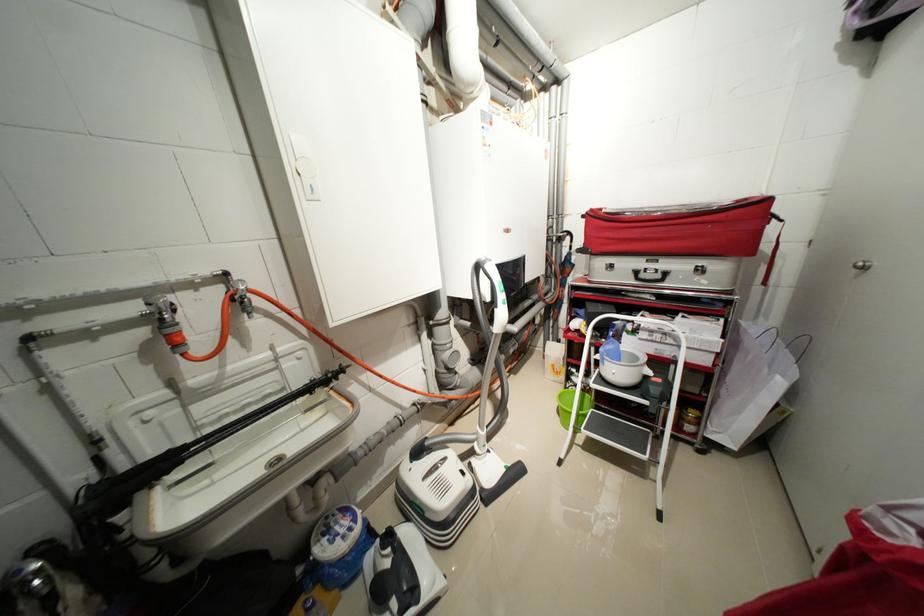
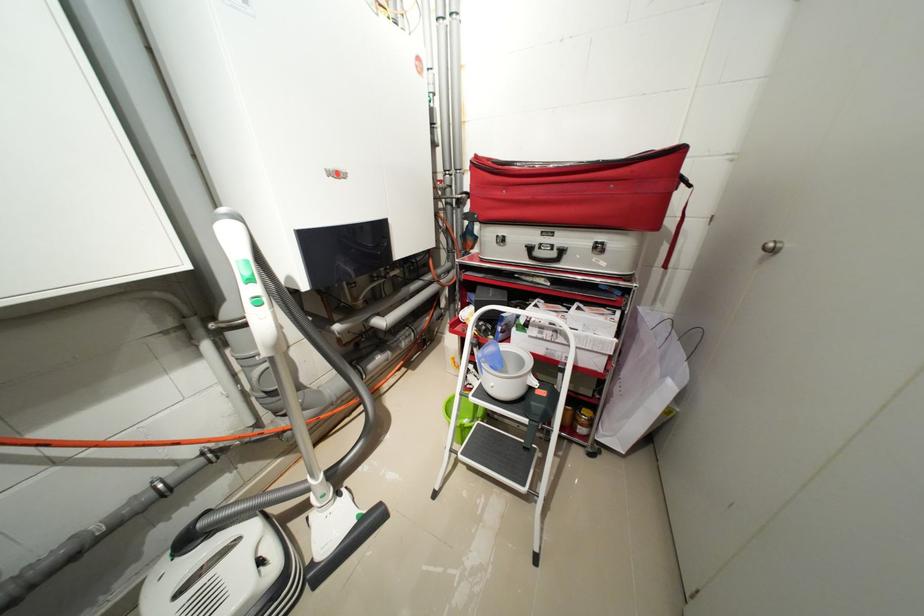
Which direction would the cameraman need to move to produce the second image?

The cameraman walked toward right, forward.